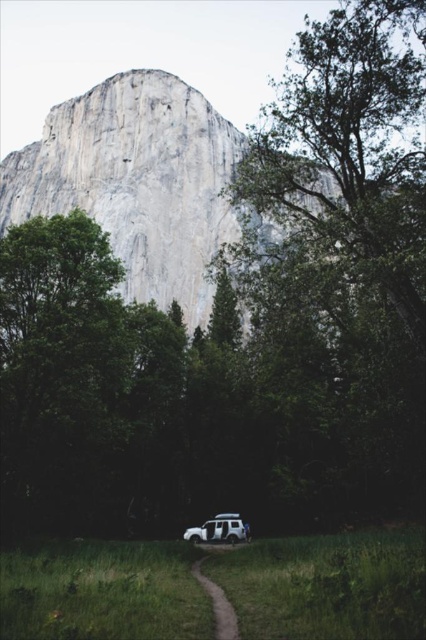
Question: Among these objects, which one is nearest to the camera?

Choices:
 (A) dirt path at center
 (B) white matte jeep at lower center

Answer: (A)

Question: Is dirt path at center above white matte jeep at lower center?

Choices:
 (A) yes
 (B) no

Answer: (B)

Question: Which point is farther to the camera?

Choices:
 (A) (224, 634)
 (B) (227, 532)

Answer: (B)

Question: Is dirt path at center thinner than white matte jeep at lower center?

Choices:
 (A) yes
 (B) no

Answer: (A)

Question: Does dirt path at center appear on the right side of white matte jeep at lower center?

Choices:
 (A) yes
 (B) no

Answer: (B)